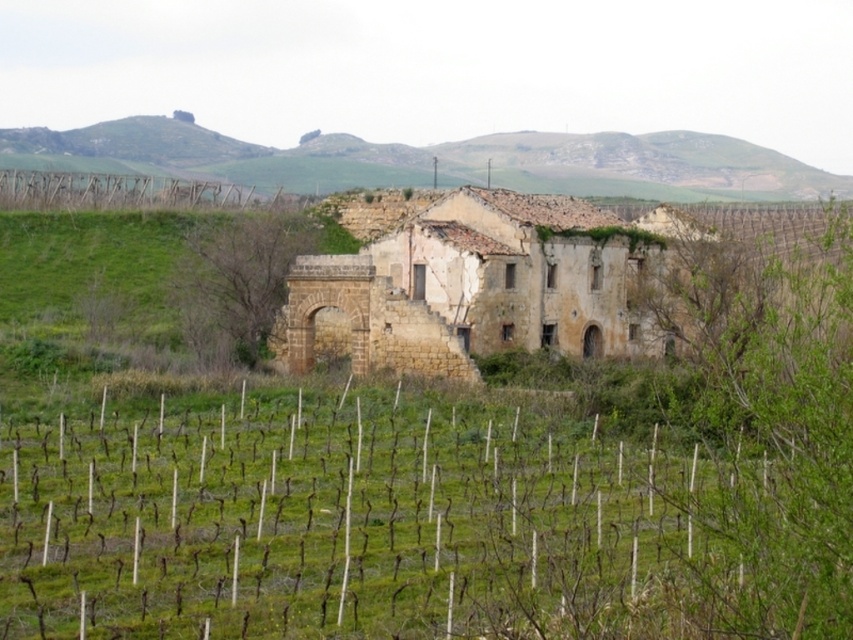
Question: Can you confirm if brown grass at center is thinner than green grassy hillside at upper center?

Choices:
 (A) no
 (B) yes

Answer: (B)

Question: Is brown grass at center positioned in front of green grassy hillside at upper center?

Choices:
 (A) yes
 (B) no

Answer: (A)

Question: Can you confirm if brown grass at center is thinner than green grassy hillside at upper center?

Choices:
 (A) yes
 (B) no

Answer: (A)

Question: Which object appears farthest from the camera in this image?

Choices:
 (A) green grassy hillside at upper center
 (B) brown grass at center

Answer: (A)

Question: Which of the following is the closest to the observer?

Choices:
 (A) (42, 141)
 (B) (218, 452)

Answer: (B)